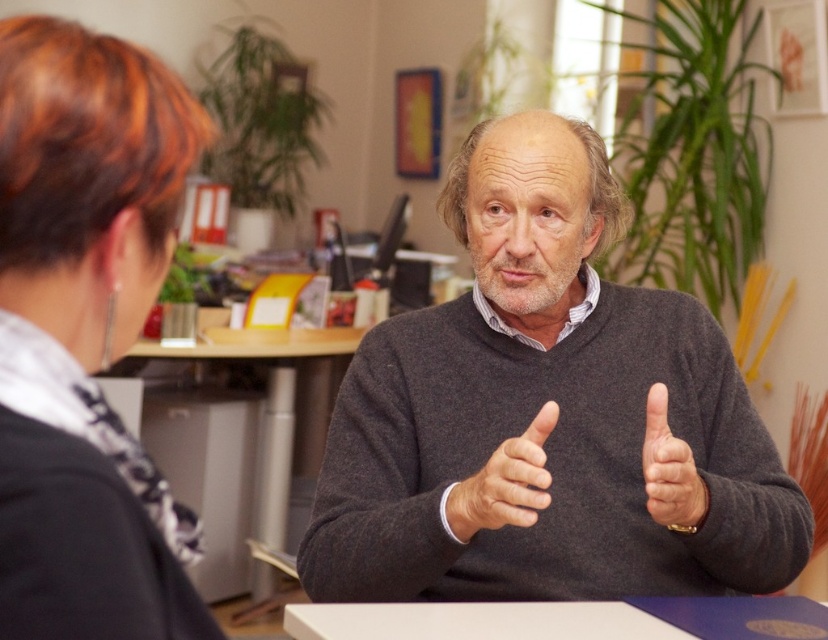
You are standing in the room where the conversation is happening. You need to pass between the dark gray sweater at center and the brown leather hand at center to reach the door on the other side. Is there enough space for you to walk through?

The dark gray sweater at center is closer to the viewer than the brown leather hand at center, so there is space between them for you to walk through.

You are a person who is 1.7 meters tall. You are standing in the room and see the white matte table at center and the gray matte hand at center. Which object is closer to your eye level?

The gray matte hand at center is closer to your eye level because it has a greater height than the white matte table at center.

You are a fashion designer observing this scene. You need to decide which item is taller between the dark gray sweater at center and the brown leather hand at center. Which one is taller?

The dark gray sweater at center is taller than the brown leather hand at center according to the description.